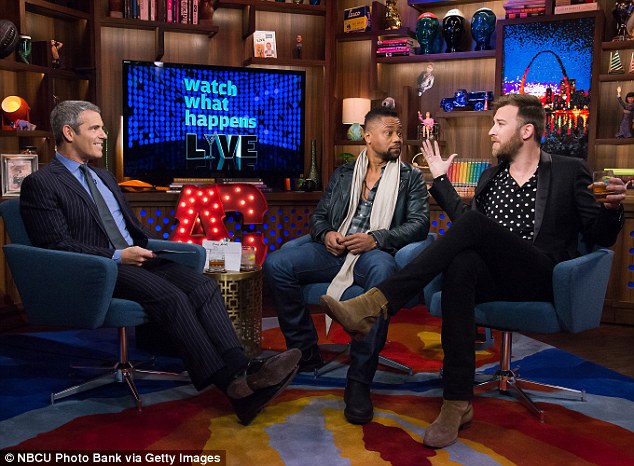
Where is `light bulb`? light bulb is located at coordinates (14, 106).